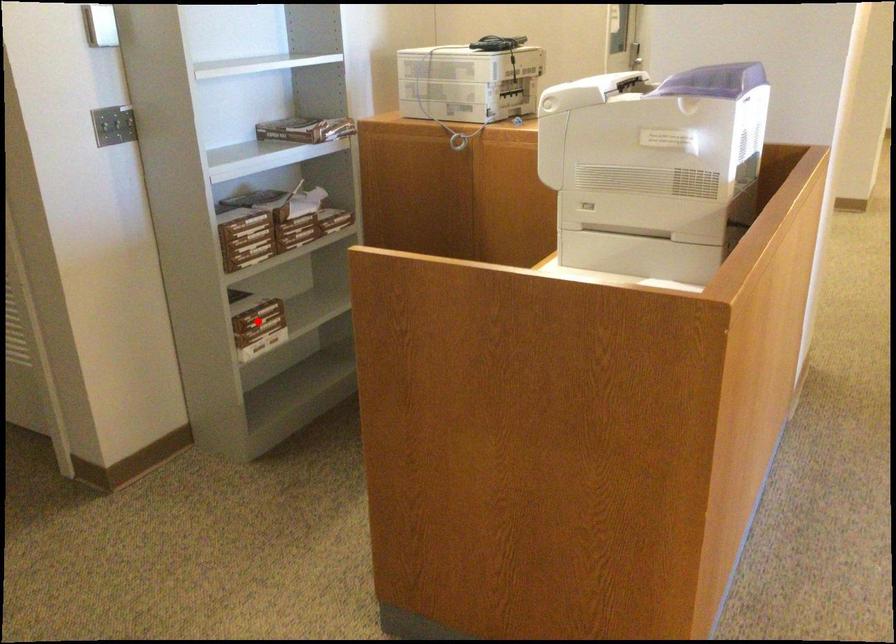
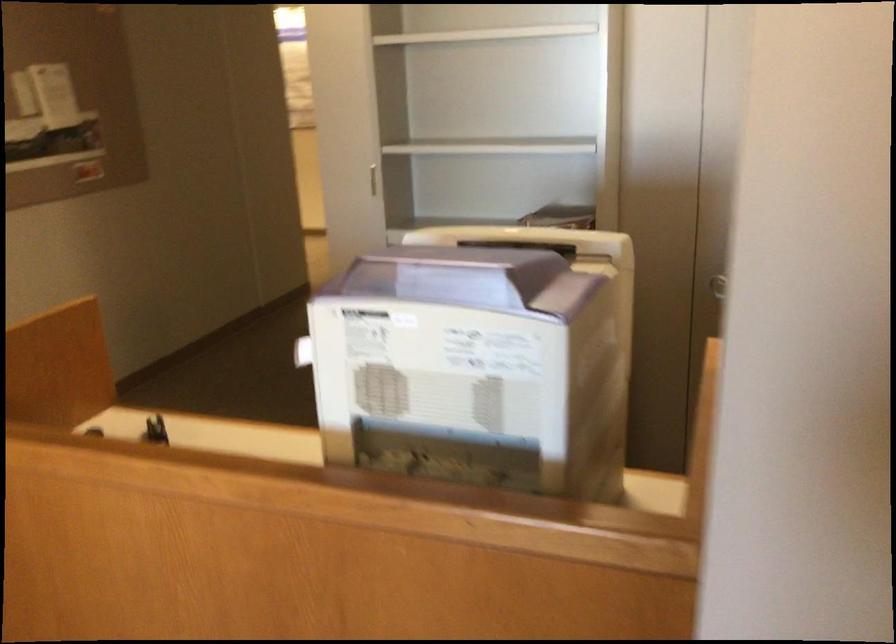
Question: I am providing you with two images of the same scene from different viewpoints. A red point is marked on the first image. Can you still see the location of the red point in image 2?

Choices:
 (A) Yes
 (B) No

Answer: (B)